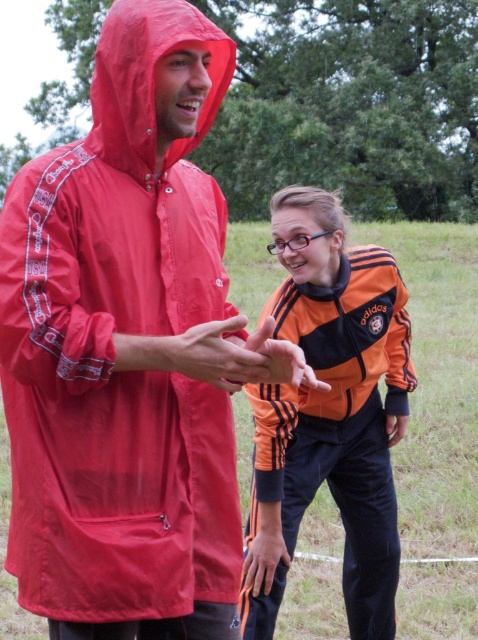
Question: Among these points, which one is farthest from the camera?

Choices:
 (A) (253, 570)
 (B) (217, 108)
 (C) (362, 365)
 (D) (252, 348)

Answer: (C)

Question: Based on their relative distances, which object is nearer to the orange adidas tracksuit at center?

Choices:
 (A) matte orange hand at center
 (B) orange matte/suede hand at center

Answer: (B)

Question: Based on their relative distances, which object is farther from the orange adidas tracksuit at center?

Choices:
 (A) matte nylon raincoat at center
 (B) matte red raincoat at upper left
 (C) orange matte/suede hand at center

Answer: (B)

Question: Is orange adidas tracksuit at center smaller than smooth orange hand at center?

Choices:
 (A) no
 (B) yes

Answer: (A)

Question: Can you confirm if matte nylon raincoat at center is thinner than matte orange hand at center?

Choices:
 (A) no
 (B) yes

Answer: (A)

Question: Is matte orange hand at center thinner than smooth orange hand at center?

Choices:
 (A) yes
 (B) no

Answer: (B)